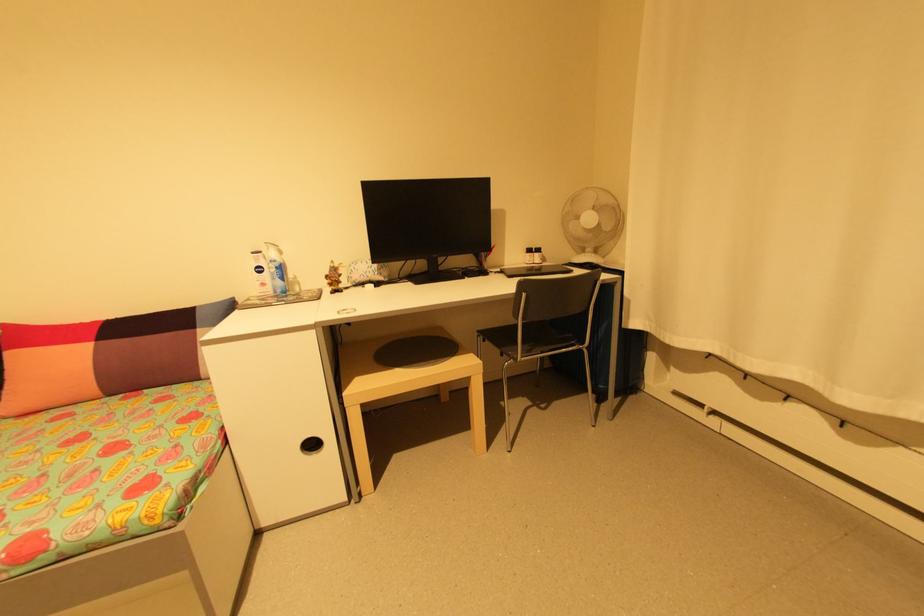
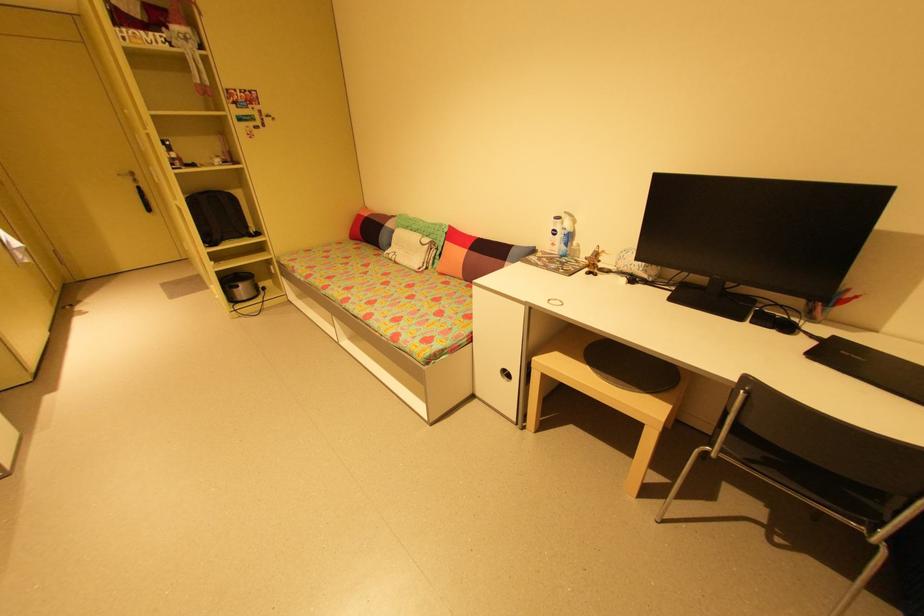
Where in the second image is the point corresponding to (x=349, y=395) from the first image?

(540, 359)